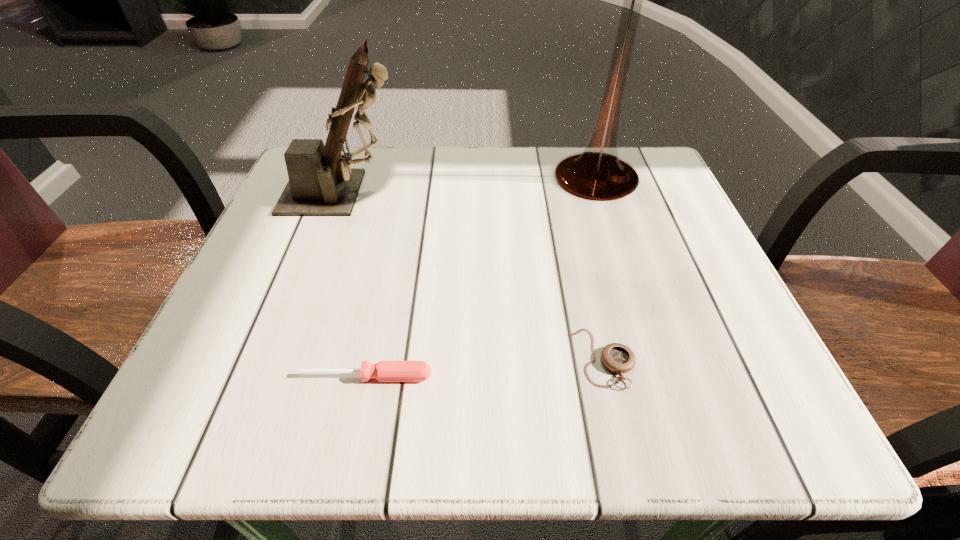
Find the location of `unoccupied position between the tallest object and the screwdriver`. unoccupied position between the tallest object and the screwdriver is located at coordinates (481, 276).

Image resolution: width=960 pixels, height=540 pixels. Identify the location of free space between the second shortest object and the tallest object. (481, 276).

What are the coordinates of `free area in between the tallest object and the pocket watch` in the screenshot? It's located at (599, 267).

Locate an element on the screen. The width and height of the screenshot is (960, 540). unoccupied area between the figurine and the tallest object is located at coordinates (470, 185).

Identify which object is located as the nearest to the third tallest object. Please provide its 2D coordinates. Your answer should be formatted as a tuple, i.e. [(x, y)], where the tuple contains the x and y coordinates of a point satisfying the conditions above.

[(618, 358)]

Identify which object is the third closest to the shortest object. Please provide its 2D coordinates. Your answer should be formatted as a tuple, i.e. [(x, y)], where the tuple contains the x and y coordinates of a point satisfying the conditions above.

[(321, 182)]

You are a GUI agent. You are given a task and a screenshot of the screen. Output one action in this format:
    pyautogui.click(x=<x>, y=<y>)
    Task: Click on the free spot that satisfies the following two spatial constraints: 1. on the front-facing side of the pocket watch; 2. on the left side of the second tallest object
    
    Given the screenshot: What is the action you would take?
    pyautogui.click(x=285, y=358)

Locate an element on the screen. The width and height of the screenshot is (960, 540). vacant area in the image that satisfies the following two spatial constraints: 1. on the front-facing side of the figurine; 2. on the left side of the screwdriver is located at coordinates (278, 376).

The width and height of the screenshot is (960, 540). In order to click on blank area in the image that satisfies the following two spatial constraints: 1. on the front-facing side of the screwdriver; 2. on the left side of the figurine in this screenshot , I will do `click(278, 376)`.

I want to click on vacant position in the image that satisfies the following two spatial constraints: 1. above the cylindrical shade of the tallest object; 2. on the front-facing side of the second tallest object, so 601,193.